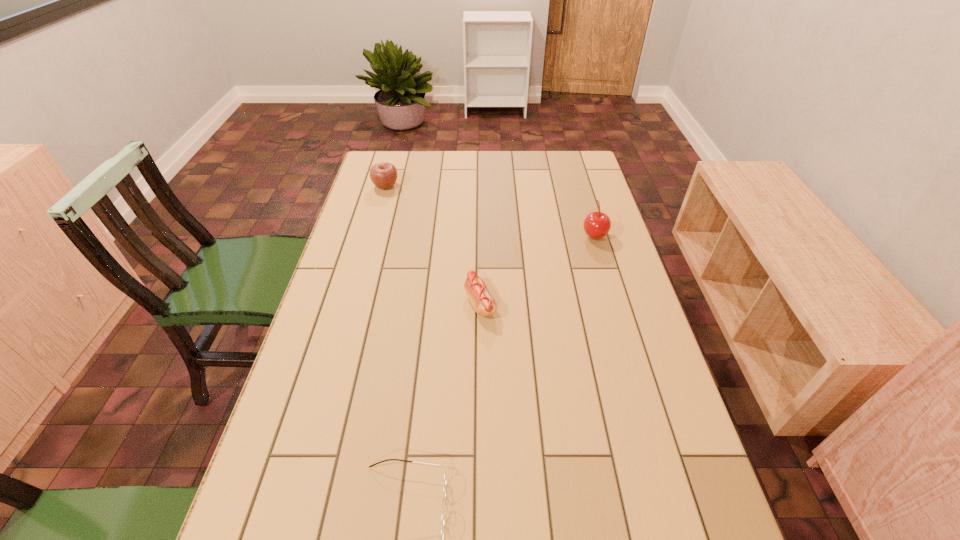
This screenshot has width=960, height=540. Identify the location of object present at the left edge. (383, 175).

The image size is (960, 540). What are the coordinates of `object at the right edge` in the screenshot? It's located at (596, 225).

Identify the location of object positioned at the far left corner. The image size is (960, 540). (383, 175).

Identify the location of free space at the far edge of the desktop. (438, 177).

This screenshot has width=960, height=540. Identify the location of free space at the left edge of the desktop. (325, 366).

Where is `vacant space at the right edge of the desktop`? The image size is (960, 540). vacant space at the right edge of the desktop is located at coordinates (682, 483).

Image resolution: width=960 pixels, height=540 pixels. In order to click on vacant space at the far right corner in this screenshot , I will do `click(590, 163)`.

Identify the location of empty space that is in between the rightmost object and the second nearest object. The width and height of the screenshot is (960, 540). (537, 269).

Find the location of a particular element. free spot between the third shortest object and the third object from left to right is located at coordinates pos(433,245).

Find the location of `vacant area that lies between the third farthest object and the third shortest object`. vacant area that lies between the third farthest object and the third shortest object is located at coordinates (433, 245).